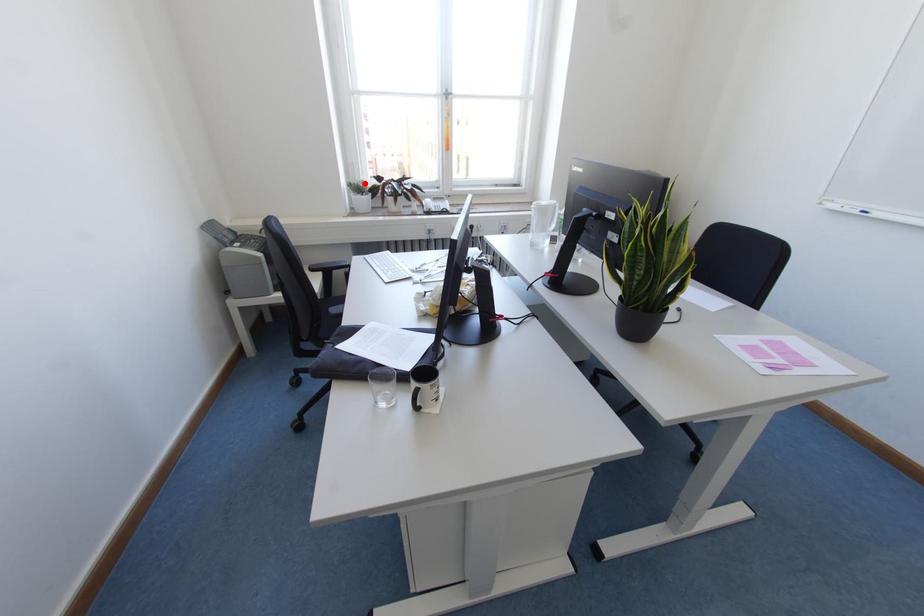
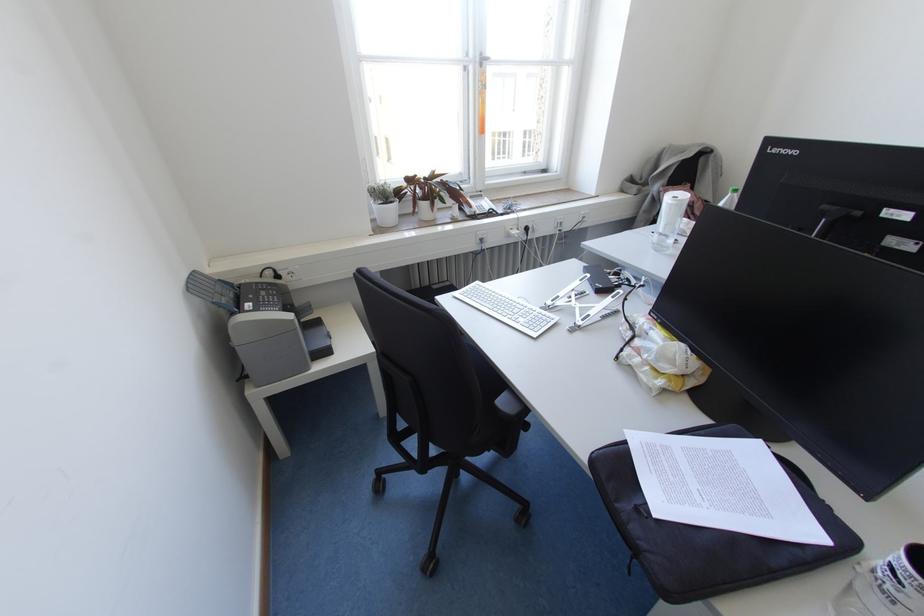
Locate, in the second image, the point that corresponds to the highlighted location in the first image.

(390, 187)